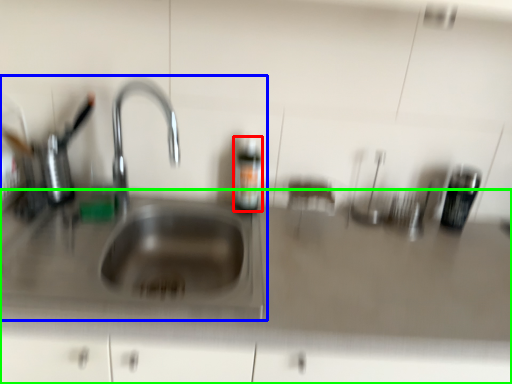
Question: Which object is the farthest from bottle (highlighted by a red box)? Choose among these: sink (highlighted by a blue box) or counter top (highlighted by a green box).

Choices:
 (A) sink
 (B) counter top

Answer: (B)